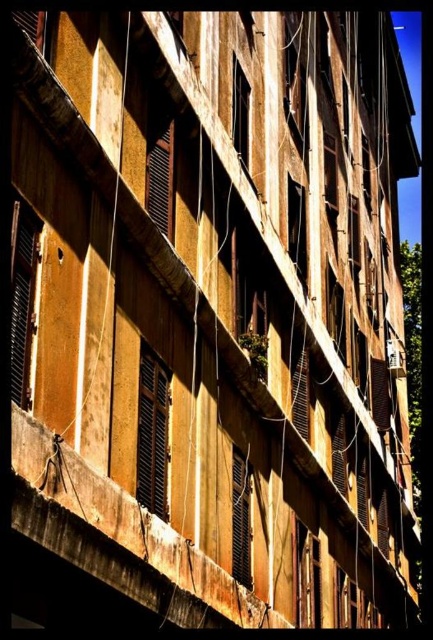
Which is more to the right, wooden window frame at center or matte black window at center?

wooden window frame at center is more to the right.

Does wooden window frame at center have a smaller size compared to matte black window at center?

No, wooden window frame at center is not smaller than matte black window at center.

Describe the element at coordinates (306, 577) in the screenshot. I see `wooden window frame at center` at that location.

The height and width of the screenshot is (640, 433). I want to click on wooden window frame at center, so (x=306, y=577).

Based on the photo, is matte brown wooden window at upper center thinner than matte black shutters at center?

No, matte brown wooden window at upper center is not thinner than matte black shutters at center.

Can you confirm if matte brown wooden window at upper center is positioned to the left of matte black shutters at center?

No, matte brown wooden window at upper center is not to the left of matte black shutters at center.

Between point (300, 140) and point (158, 140), which one is positioned behind?

The point (300, 140) is more distant.

This screenshot has height=640, width=433. I want to click on matte brown wooden window at upper center, so click(296, 81).

Can you confirm if matte black shutters at center is positioned below matte black window at center?

Indeed, matte black shutters at center is positioned under matte black window at center.

Is matte black shutters at center to the left of matte black window at center from the viewer's perspective?

Correct, you'll find matte black shutters at center to the left of matte black window at center.

Who is more forward, [160,173] or [246,90]?

Point [160,173]

Where is `matte black shutters at center`? matte black shutters at center is located at coordinates (161, 173).